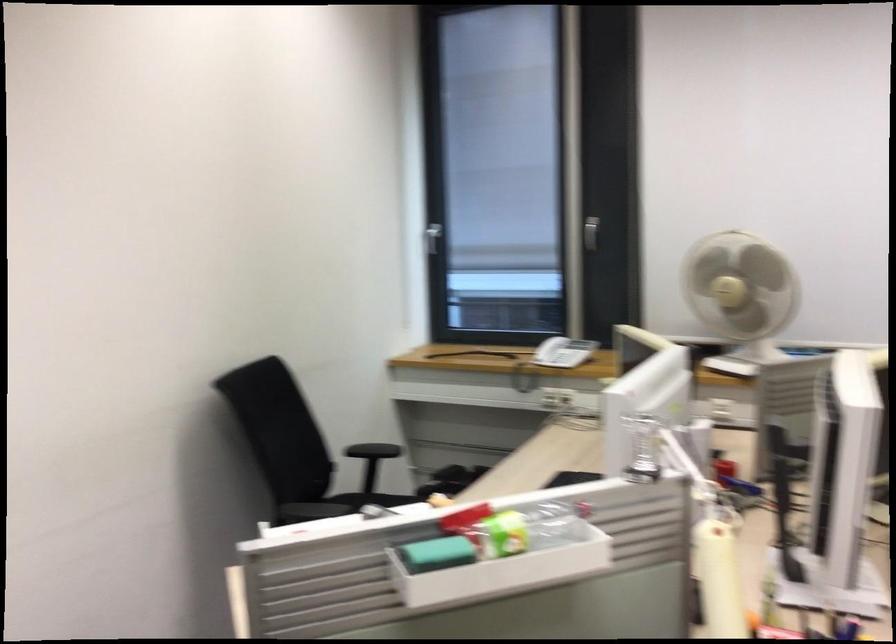
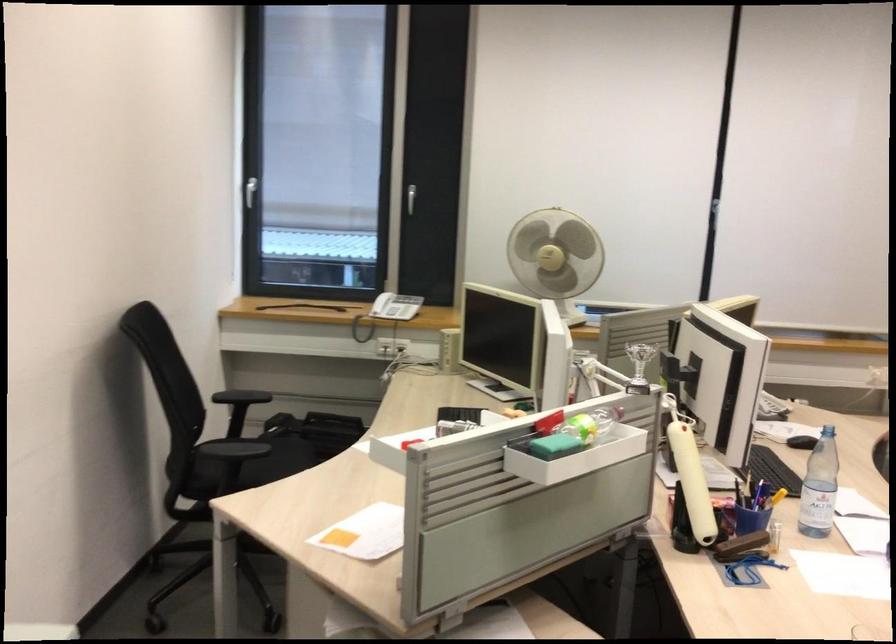
Locate, in the second image, the point that corresponds to [558,355] in the first image.

(386, 312)